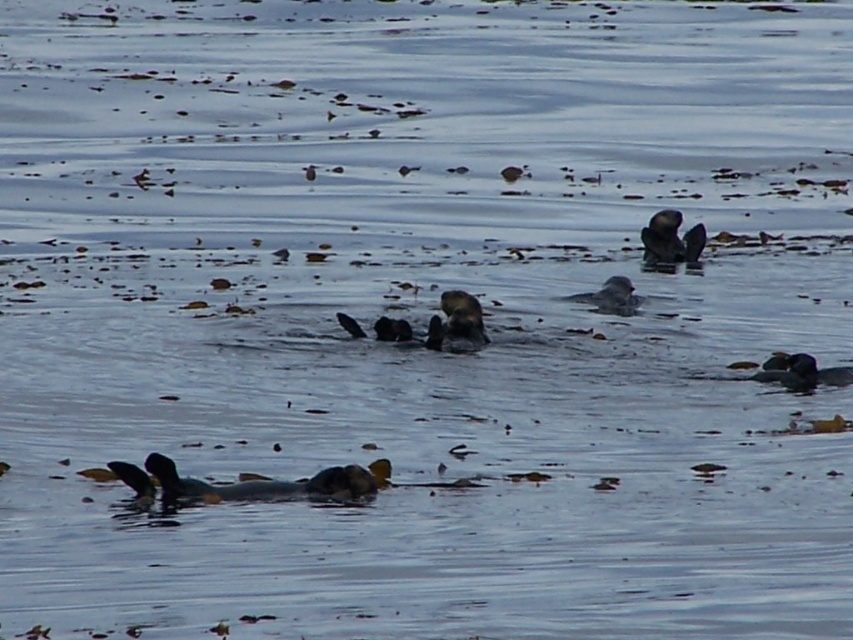
You are a marine biologist observing the scene. You need to locate the brown fuzzy otter at center. What are its coordinates in the image?

The coordinates of the brown fuzzy otter at center are at point (457, 323).

You are a photographer trying to capture the brown fuzzy otter at center and the dark gray fur duck at lower left in the same frame. Which animal will appear smaller in your photo?

The dark gray fur duck at lower left will appear smaller in the photo because it has a lesser height compared to the brown fuzzy otter at center.

You are a photographer trying to capture a photo of the brown fuzzy otter at center and the dark gray fur duck at lower left. Which animal is positioned lower in the image?

The dark gray fur duck at lower left is positioned lower than the brown fuzzy otter at center.